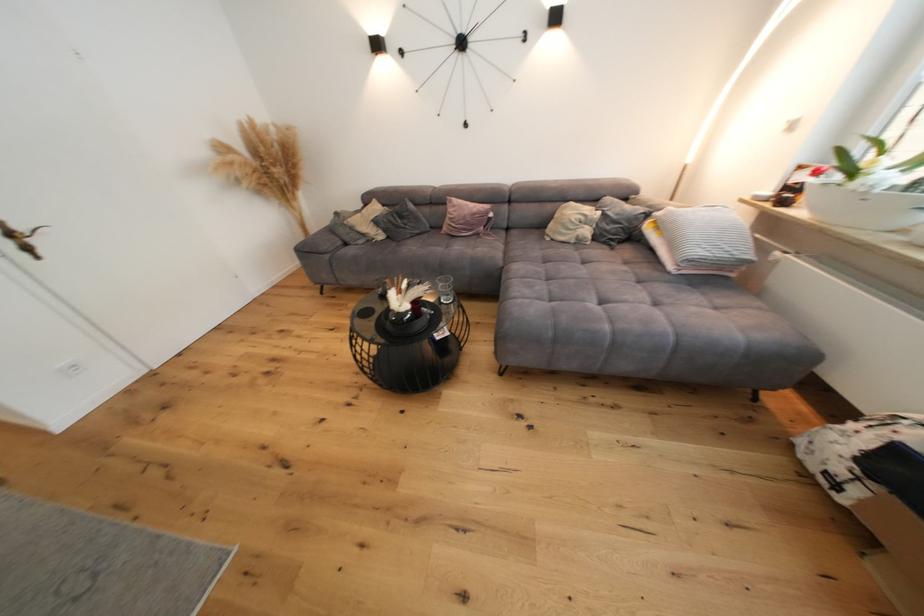
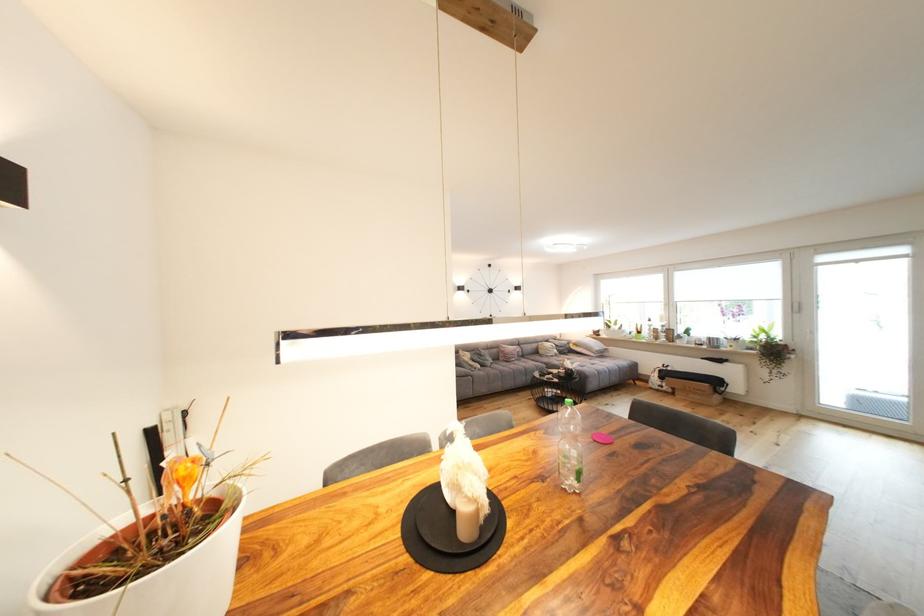
Find the pixel in the second image that matches (x=383, y=224) in the first image.

(480, 361)